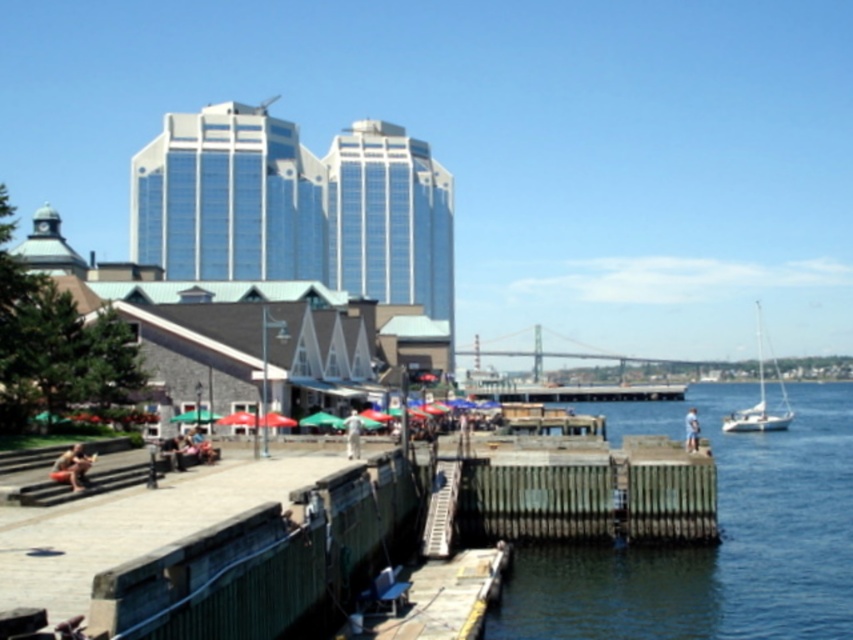
Is orange fabric person at lower left bigger than white fabric shirt at lower right?

No.

Identify the location of orange fabric person at lower left. (73, 467).

Does clear water at dock right have a larger size compared to white glossy sailboat at right?

No, clear water at dock right is not bigger than white glossy sailboat at right.

Is clear water at dock right above white glossy sailboat at right?

Actually, clear water at dock right is below white glossy sailboat at right.

Who is more forward, (593,605) or (769,349)?

Positioned in front is point (593,605).

You are a GUI agent. You are given a task and a screenshot of the screen. Output one action in this format:
    pyautogui.click(x=<x>, y=<y>)
    Task: Click on the clear water at dock right
    This screenshot has width=853, height=640.
    Given the screenshot: What is the action you would take?
    pyautogui.click(x=720, y=534)

Which of these two, clear water at dock right or white fabric shirt at lower right, stands shorter?

With less height is clear water at dock right.

Where is `clear water at dock right`? The height and width of the screenshot is (640, 853). clear water at dock right is located at coordinates (720, 534).